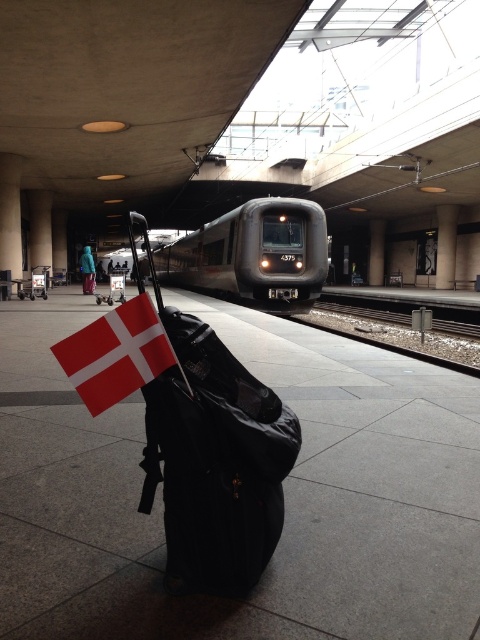
From the picture: Is metallic gray train at center smaller than red fabric flag at center?

No.

Is point (300, 262) closer to camera compared to point (144, 314)?

No.

Locate an element on the screen. The width and height of the screenshot is (480, 640). metallic gray train at center is located at coordinates (252, 253).

Is point (260, 218) farther from camera compared to point (470, 324)?

Yes, point (260, 218) is farther from viewer.

Is metallic gray train at center shorter than black metal train track at center?

No.

Which is behind, point (228, 248) or point (346, 304)?

Point (346, 304)

I want to click on metallic gray train at center, so coord(252,253).

How much distance is there between matte black suitcase at center and red fabric flag at center?

They are 18.75 inches apart.

Who is more distant from viewer, [192,576] or [97,355]?

Point [192,576]

Between point (206, 403) and point (108, 330), which one is positioned behind?

Positioned behind is point (206, 403).

This screenshot has width=480, height=640. I want to click on matte black suitcase at center, so click(x=215, y=458).